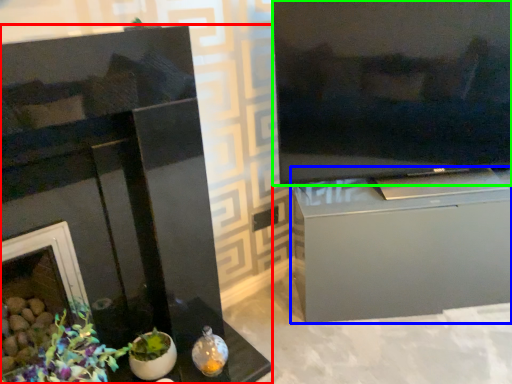
Question: Based on their relative distances, which object is farther from fireplace (highlighted by a red box)? Choose from cabinetry (highlighted by a blue box) and television (highlighted by a green box).

Choices:
 (A) cabinetry
 (B) television

Answer: (B)